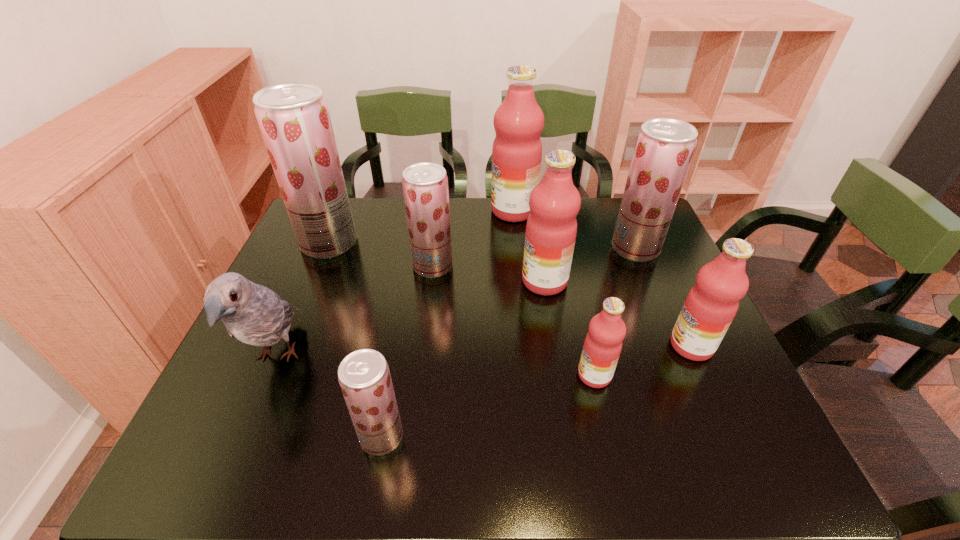
What are the coordinates of `free spot between the smallest pink fruit juice and the rightmost pink fruit juice` in the screenshot? It's located at (643, 360).

What are the coordinates of `empty space between the nearest object and the smallest pink fruit juice` in the screenshot? It's located at (488, 406).

Where is `vacant area that lies between the second smallest pink fruit juice and the nearest strawberry fruit juice`? vacant area that lies between the second smallest pink fruit juice and the nearest strawberry fruit juice is located at coordinates (537, 391).

Locate an element on the screen. This screenshot has height=540, width=960. vacant area between the nearest object and the second biggest strawberry fruit juice is located at coordinates pos(509,342).

Find the location of a particular element. Image resolution: width=960 pixels, height=540 pixels. free spot between the smallest pink fruit juice and the nearest strawberry fruit juice is located at coordinates (488, 406).

You are a GUI agent. You are given a task and a screenshot of the screen. Output one action in this format:
    pyautogui.click(x=<x>, y=<y>)
    Task: Click on the free space between the smallest pink fruit juice and the third biggest pink fruit juice
    The height and width of the screenshot is (540, 960).
    Given the screenshot: What is the action you would take?
    pyautogui.click(x=643, y=360)

The height and width of the screenshot is (540, 960). What are the coordinates of `empty space that is in between the gray parrot and the smallest strawberry fruit juice` in the screenshot? It's located at (329, 397).

At what (x,y) coordinates should I click in order to perform the action: click on free space that is in between the third biggest pink fruit juice and the biggest strawberry fruit juice. Please return your answer as a coordinate pair (x, y). The height and width of the screenshot is (540, 960). Looking at the image, I should click on (511, 294).

Select which object is the fourth closest to the farthest fruit juice. Please provide its 2D coordinates. Your answer should be formatted as a tuple, i.e. [(x, y)], where the tuple contains the x and y coordinates of a point satisfying the conditions above.

[(294, 120)]

Locate which object ranks fourth in proximity to the second smallest strawberry fruit juice. Please provide its 2D coordinates. Your answer should be formatted as a tuple, i.e. [(x, y)], where the tuple contains the x and y coordinates of a point satisfying the conditions above.

[(254, 314)]